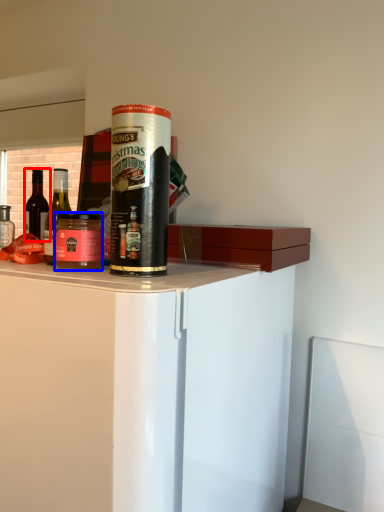
Question: Which object is further to the camera taking this photo, bottle (highlighted by a red box) or beverage (highlighted by a blue box)?

Choices:
 (A) bottle
 (B) beverage

Answer: (A)